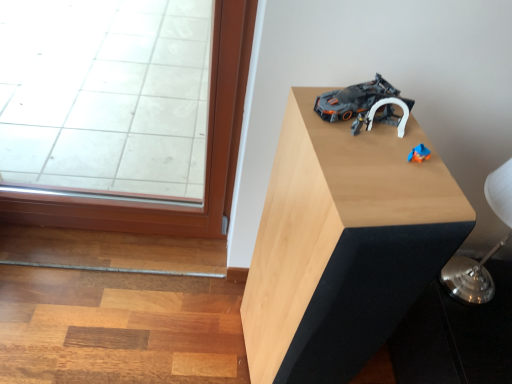
At what (x,y) coordinates should I click in order to perform the action: click on silver metallic table lamp at upper right. Please return your answer as a coordinate pair (x, y). The image size is (512, 384). Looking at the image, I should click on (488, 252).

The image size is (512, 384). What do you see at coordinates (343, 245) in the screenshot?
I see `light wood table at upper right` at bounding box center [343, 245].

Locate an element on the screen. This screenshot has height=384, width=512. silver metallic table lamp at upper right is located at coordinates (488, 252).

Considering the sizes of dark gray plastic toy car at upper right and silver metallic table lamp at upper right in the image, is dark gray plastic toy car at upper right wider or thinner than silver metallic table lamp at upper right?

Clearly, dark gray plastic toy car at upper right has less width compared to silver metallic table lamp at upper right.

The width and height of the screenshot is (512, 384). What are the coordinates of `table lamp on the right of dark gray plastic toy car at upper right` in the screenshot? It's located at (488, 252).

Is dark gray plastic toy car at upper right in front of or behind silver metallic table lamp at upper right in the image?

dark gray plastic toy car at upper right is in front of silver metallic table lamp at upper right.

Can you tell me how much dark gray plastic toy car at upper right and silver metallic table lamp at upper right differ in facing direction?

dark gray plastic toy car at upper right and silver metallic table lamp at upper right are facing 14.3 degrees away from each other.

The image size is (512, 384). Identify the location of furniture on the left side of silver metallic table lamp at upper right. (343, 245).

Looking at this image, considering the sizes of objects light wood table at upper right and silver metallic table lamp at upper right in the image provided, who is bigger, light wood table at upper right or silver metallic table lamp at upper right?

light wood table at upper right.

Between light wood table at upper right and silver metallic table lamp at upper right, which one has larger width?

Wider between the two is light wood table at upper right.

Is light wood table at upper right taller or shorter than silver metallic table lamp at upper right?

Clearly, light wood table at upper right is taller compared to silver metallic table lamp at upper right.

Does silver metallic table lamp at upper right have a larger size compared to dark gray plastic toy car at upper right?

Correct, silver metallic table lamp at upper right is larger in size than dark gray plastic toy car at upper right.

Is silver metallic table lamp at upper right wider or thinner than dark gray plastic toy car at upper right?

In the image, silver metallic table lamp at upper right appears to be wider than dark gray plastic toy car at upper right.

Is silver metallic table lamp at upper right to the left of dark gray plastic toy car at upper right from the viewer's perspective?

No.

From the image's perspective, relative to dark gray plastic toy car at upper right, is silver metallic table lamp at upper right above or below?

From the image's perspective, silver metallic table lamp at upper right appears below dark gray plastic toy car at upper right.

Between dark gray plastic toy car at upper right and light wood table at upper right, which one has larger width?

Wider between the two is light wood table at upper right.

Is dark gray plastic toy car at upper right inside or outside of light wood table at upper right?

dark gray plastic toy car at upper right can be found inside light wood table at upper right.

Which object is closer to the camera taking this photo, dark gray plastic toy car at upper right or light wood table at upper right?

light wood table at upper right.

From the image's perspective, which is below, dark gray plastic toy car at upper right or light wood table at upper right?

light wood table at upper right is shown below in the image.

Is point (470, 277) more distant than point (264, 296)?

Yes, it is behind point (264, 296).

Is silver metallic table lamp at upper right spatially inside light wood table at upper right, or outside of it?

silver metallic table lamp at upper right lies outside light wood table at upper right.

You are a GUI agent. You are given a task and a screenshot of the screen. Output one action in this format:
    pyautogui.click(x=<x>, y=<y>)
    Task: Click on the furniture on the left of silver metallic table lamp at upper right
    This screenshot has height=384, width=512.
    Given the screenshot: What is the action you would take?
    pyautogui.click(x=343, y=245)

Between point (327, 198) and point (314, 109), which one is positioned in front?

The point (327, 198) is more forward.

Based on the photo, is light wood table at upper right oriented towards dark gray plastic toy car at upper right?

No, light wood table at upper right is not turned towards dark gray plastic toy car at upper right.

Is light wood table at upper right taller or shorter than dark gray plastic toy car at upper right?

Clearly, light wood table at upper right is taller compared to dark gray plastic toy car at upper right.

How different are the orientations of light wood table at upper right and dark gray plastic toy car at upper right in degrees?

The facing directions of light wood table at upper right and dark gray plastic toy car at upper right are 0.00264 degrees apart.

The height and width of the screenshot is (384, 512). I want to click on toy in front of the silver metallic table lamp at upper right, so click(x=364, y=105).

At what (x,y) coordinates should I click in order to perform the action: click on table lamp above the light wood table at upper right (from the image's perspective). Please return your answer as a coordinate pair (x, y). Image resolution: width=512 pixels, height=384 pixels. Looking at the image, I should click on (488, 252).

Based on their spatial positions, is silver metallic table lamp at upper right or dark gray plastic toy car at upper right further from light wood table at upper right?

silver metallic table lamp at upper right is further to light wood table at upper right.

Considering their positions, is dark gray plastic toy car at upper right positioned closer to silver metallic table lamp at upper right than light wood table at upper right?

light wood table at upper right lies closer to silver metallic table lamp at upper right than the other object.

Which object lies nearer to the anchor point silver metallic table lamp at upper right, light wood table at upper right or dark gray plastic toy car at upper right?

The object closer to silver metallic table lamp at upper right is light wood table at upper right.

When comparing their distances from dark gray plastic toy car at upper right, does light wood table at upper right or silver metallic table lamp at upper right seem further?

silver metallic table lamp at upper right is further to dark gray plastic toy car at upper right.

When comparing their distances from dark gray plastic toy car at upper right, does silver metallic table lamp at upper right or light wood table at upper right seem further?

silver metallic table lamp at upper right.

Which object lies nearer to the anchor point light wood table at upper right, dark gray plastic toy car at upper right or silver metallic table lamp at upper right?

The object closer to light wood table at upper right is dark gray plastic toy car at upper right.

Find the location of a particular element. toy between light wood table at upper right and silver metallic table lamp at upper right in the horizontal direction is located at coordinates (364, 105).